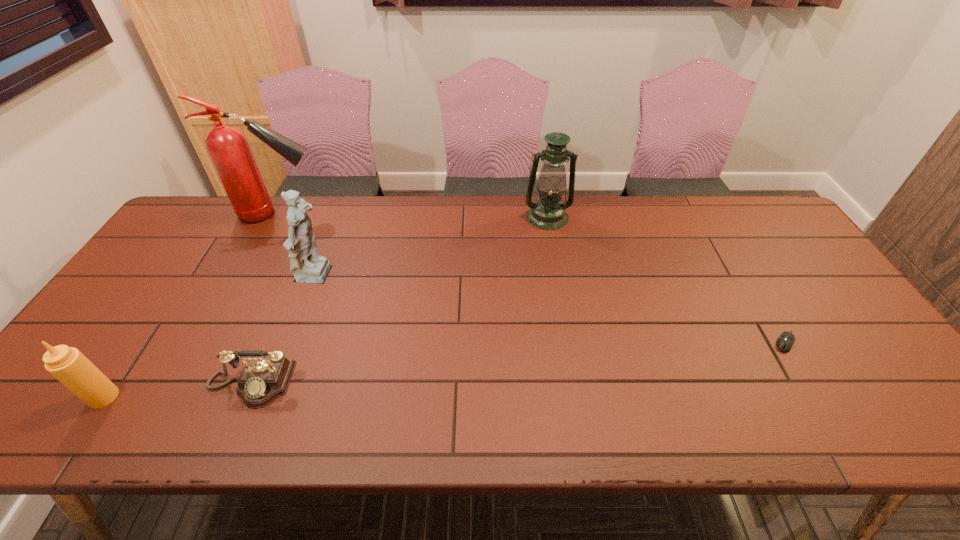
Image resolution: width=960 pixels, height=540 pixels. In order to click on fire extinguisher in this screenshot , I will do `click(228, 148)`.

Identify the location of oil lamp. (548, 213).

Locate an element on the screen. The height and width of the screenshot is (540, 960). figurine is located at coordinates [x=309, y=267].

Find the location of a particular element. The width and height of the screenshot is (960, 540). the third shortest object is located at coordinates (67, 364).

This screenshot has height=540, width=960. I want to click on telephone, so click(263, 379).

Where is `the third nearest object`? the third nearest object is located at coordinates (785, 341).

Identify the location of the shortest object. (785, 341).

The width and height of the screenshot is (960, 540). In order to click on vacant area situated at the nozzle end of the tallest object in this screenshot , I will do click(x=371, y=214).

In order to click on free space located on the right of the fifth object from left to right in this screenshot , I will do click(671, 217).

At what (x,y) coordinates should I click in order to perform the action: click on free spot located on the front-facing side of the third farthest object. Please return your answer as a coordinate pair (x, y). The image size is (960, 540). Looking at the image, I should click on (396, 278).